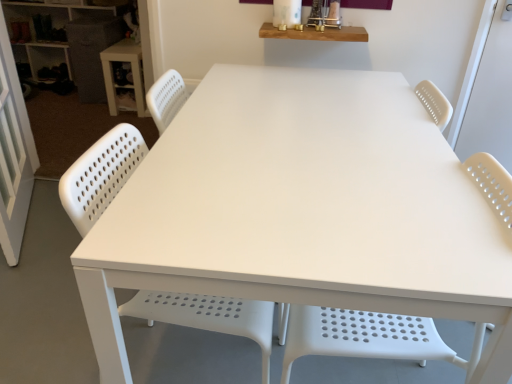
Question: Is white perforated plastic chair at center, which is the 1th chair from right to left, situated inside white perforated plastic chair at lower left, the 1th chair from the left, or outside?

Choices:
 (A) outside
 (B) inside

Answer: (A)

Question: From the image's perspective, is white perforated plastic chair at center, which is the 1th chair from right to left, located above or below white perforated plastic chair at lower left, the 1th chair from the left?

Choices:
 (A) below
 (B) above

Answer: (A)

Question: Estimate the real-world distances between objects in this image. Which object is closer to the matte white shelves at upper left?

Choices:
 (A) white perforated plastic chair at lower left, which is the second chair in right-to-left order
 (B) white plastic table at upper left
 (C) white perforated plastic chair at center, the 2th chair in the left-to-right sequence

Answer: (B)

Question: Considering the real-world distances, which object is farthest from the matte white shelves at upper left?

Choices:
 (A) white perforated plastic chair at lower left, which is the second chair in right-to-left order
 (B) white perforated plastic chair at center, the 2th chair in the left-to-right sequence
 (C) white plastic table at upper left

Answer: (B)